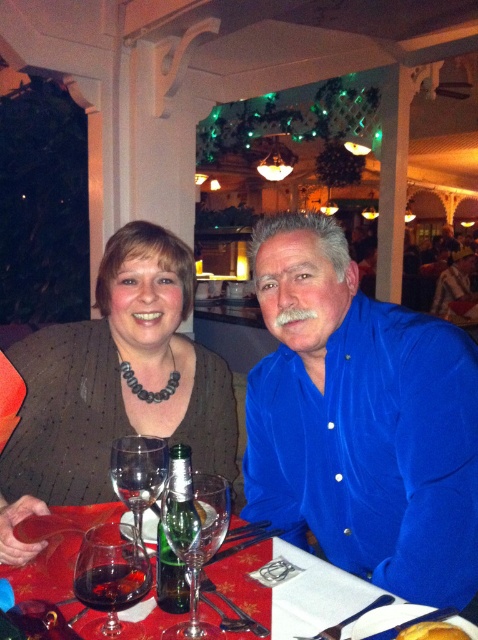
Question: Is red fabric tablecloth at center thinner than clear glass wine glass at center?

Choices:
 (A) yes
 (B) no

Answer: (B)

Question: Which point is farther to the camera?

Choices:
 (A) red fabric tablecloth at center
 (B) matte brown sweater at center

Answer: (B)

Question: Observing the image, what is the correct spatial positioning of clear glass wine glass at center in reference to transparent glass wine glass at lower center?

Choices:
 (A) below
 (B) above

Answer: (A)

Question: Is clear glass wine glass at center to the right of green glass bottle at center from the viewer's perspective?

Choices:
 (A) yes
 (B) no

Answer: (A)

Question: Which point is closer to the camera taking this photo?

Choices:
 (A) (213, 540)
 (B) (367, 509)
 (C) (423, 627)

Answer: (C)

Question: Based on their relative distances, which object is farther from the dark red glass at center?

Choices:
 (A) matte brown sweater at center
 (B) clear glass wine glass at center

Answer: (A)